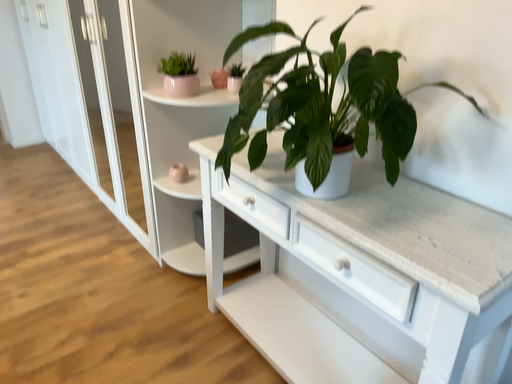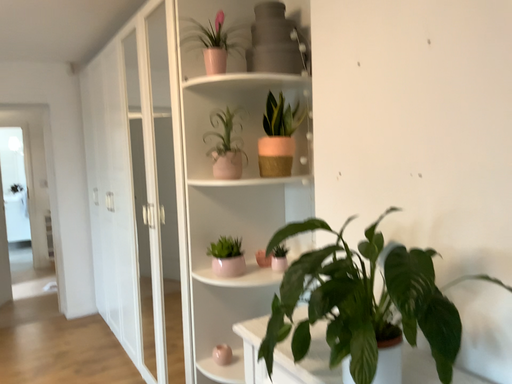
Question: Which way did the camera rotate in the video?

Choices:
 (A) rotated right
 (B) rotated left

Answer: (B)